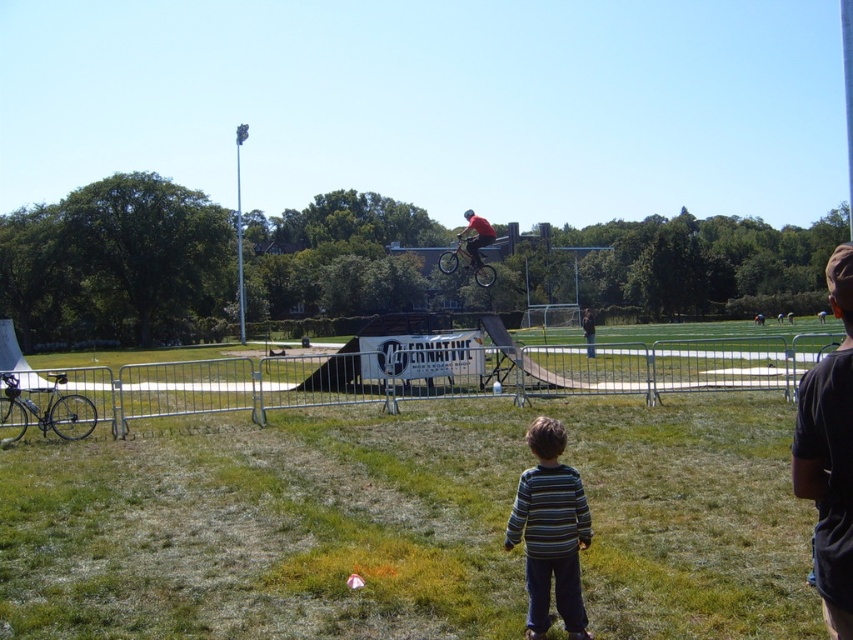
What are the coordinates of the striped sweater at center in the image?

The striped sweater at center is located at point (550, 531).

You are a photographer trying to capture both the striped sweater at center and the shiny metallic bicycle at center in a single frame. Which object should you focus on first if you want to ensure both are in focus?

The striped sweater at center is shorter than the shiny metallic bicycle at center, so you should focus on the shiny metallic bicycle at center first. This ensures the depth of field captures both the taller bicycle and the shorter sweater in focus.